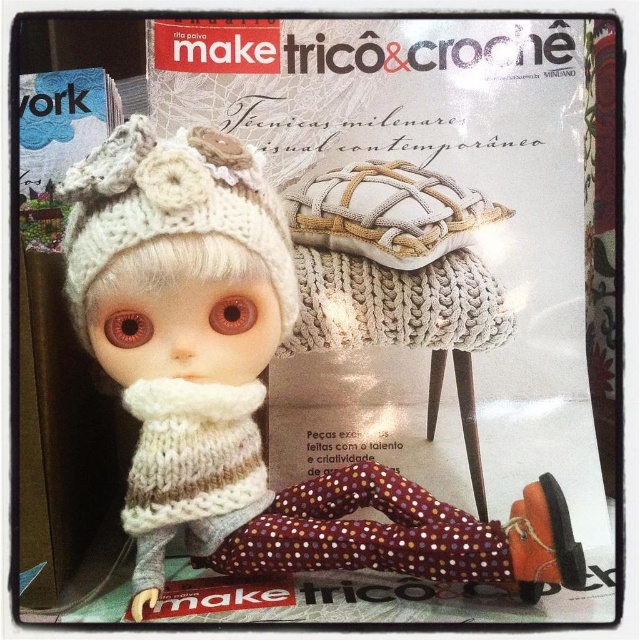
You are a craft designer who wants to display the white knitted doll at center and the white knitted hat at center on a shelf. The shelf has a height limit of 20 cm. If the doll is taller than the hat, will both items fit vertically on the shelf without exceeding the height limit?

The white knitted doll at center is taller than the white knitted hat at center. However, the exact heights are not provided, so it is impossible to determine if both will fit within the 20 cm height limit without additional information about their individual dimensions.